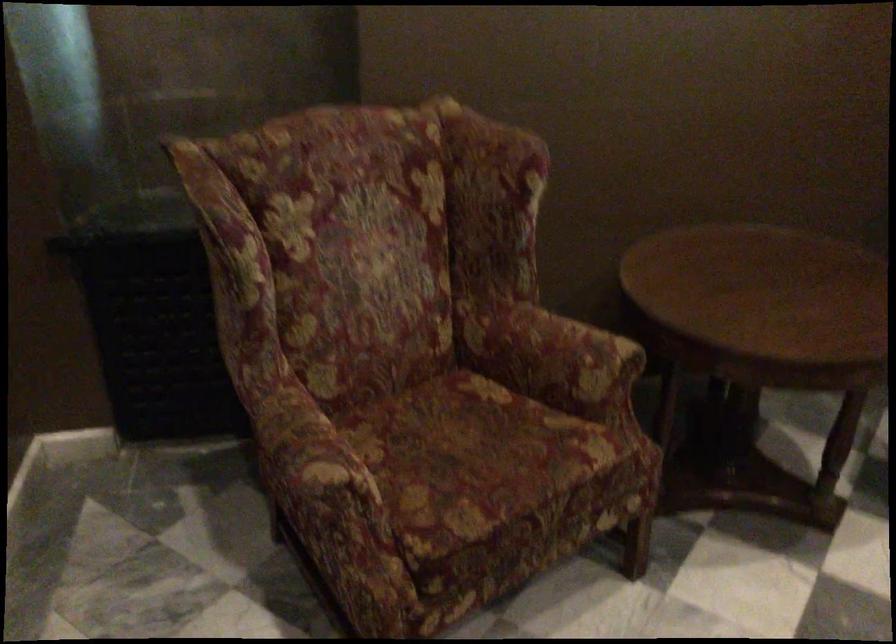
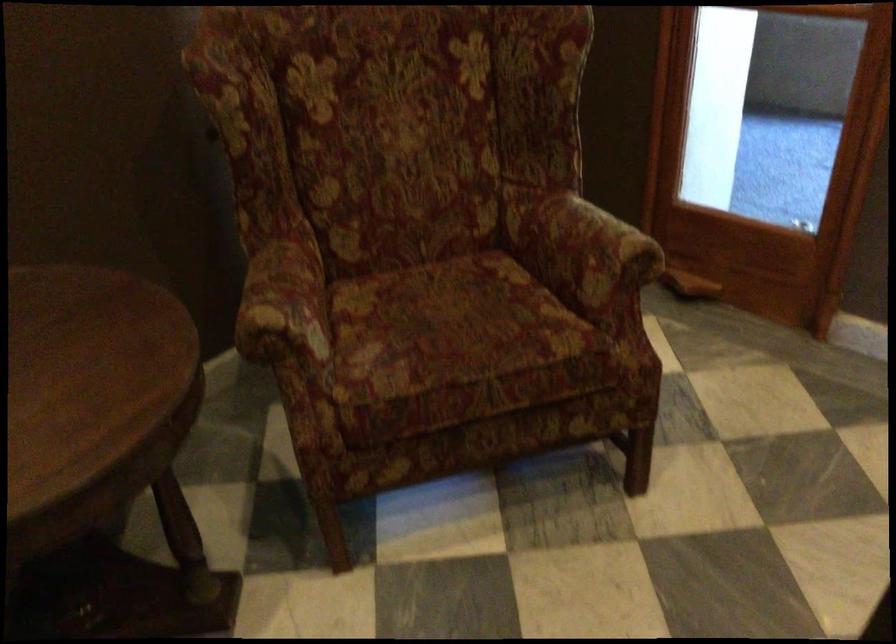
Question: The camera is either moving clockwise (left) or counter-clockwise (right) around the object. The first image is from the beginning of the video and the second image is from the end. Is the camera moving left or right when shooting the video?

Choices:
 (A) Left
 (B) Right

Answer: (A)